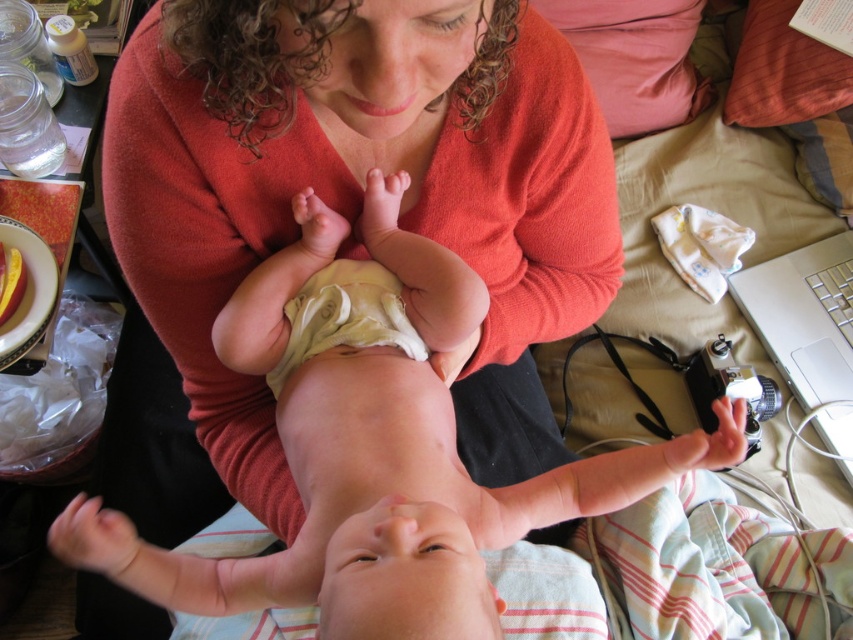
Question: Which of the following is the closest to the observer?

Choices:
 (A) (820, 426)
 (B) (265, 380)
 (C) (270, 241)
 (D) (483, 291)

Answer: (D)

Question: Which of the following is the closest to the observer?

Choices:
 (A) light yellow cloth diaper at center
 (B) silver metallic laptop at lower right

Answer: (A)

Question: Is matte orange sweater at center positioned before light yellow cloth diaper at center?

Choices:
 (A) no
 (B) yes

Answer: (B)

Question: Is the position of matte orange sweater at center less distant than that of soft beige diaper at center?

Choices:
 (A) yes
 (B) no

Answer: (A)

Question: Where is matte orange sweater at center located in relation to light yellow cloth diaper at center in the image?

Choices:
 (A) below
 (B) above

Answer: (A)

Question: Which is farther from the soft beige diaper at center?

Choices:
 (A) matte orange sweater at center
 (B) silver metallic laptop at lower right

Answer: (B)